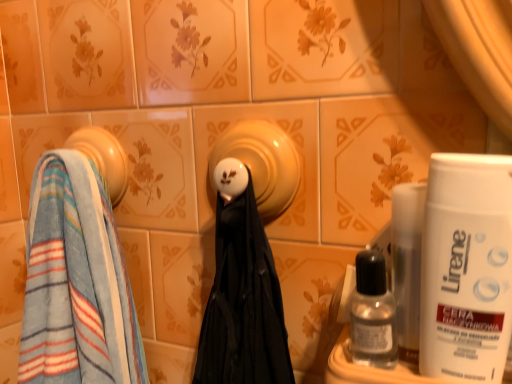
Question: Is transparent plastic bottle at lower right positioned behind blue striped towel at left, positioned as the 1th towel in top-to-bottom order?

Choices:
 (A) no
 (B) yes

Answer: (A)

Question: Is transparent plastic bottle at lower right facing towards blue striped towel at left, positioned as the second towel in bottom-to-top order?

Choices:
 (A) no
 (B) yes

Answer: (A)

Question: From the image's perspective, does transparent plastic bottle at lower right appear higher than blue striped towel at left, positioned as the 1th towel in top-to-bottom order?

Choices:
 (A) no
 (B) yes

Answer: (A)

Question: Can you confirm if transparent plastic bottle at lower right is wider than blue striped towel at left, positioned as the 1th towel in top-to-bottom order?

Choices:
 (A) no
 (B) yes

Answer: (B)

Question: From a real-world perspective, is transparent plastic bottle at lower right on top of blue striped towel at left, positioned as the second towel in bottom-to-top order?

Choices:
 (A) no
 (B) yes

Answer: (A)

Question: Is point (455, 246) positioned closer to the camera than point (391, 301)?

Choices:
 (A) farther
 (B) closer

Answer: (B)

Question: Considering the positions of white matte shaving cream at right and transparent plastic bottle at lower right in the image, is white matte shaving cream at right bigger or smaller than transparent plastic bottle at lower right?

Choices:
 (A) small
 (B) big

Answer: (B)

Question: From the image's perspective, is white matte shaving cream at right above or below transparent plastic bottle at lower right?

Choices:
 (A) below
 (B) above

Answer: (B)

Question: In terms of height, does white matte shaving cream at right look taller or shorter compared to transparent plastic bottle at lower right?

Choices:
 (A) short
 (B) tall

Answer: (B)

Question: In terms of width, does matte yellow ceramic at center look wider or thinner when compared to blue striped towel at left, positioned as the 1th towel in top-to-bottom order?

Choices:
 (A) wide
 (B) thin

Answer: (A)

Question: From their relative heights in the image, would you say matte yellow ceramic at center is taller or shorter than blue striped towel at left, positioned as the second towel in bottom-to-top order?

Choices:
 (A) short
 (B) tall

Answer: (B)

Question: Is matte yellow ceramic at center inside or outside of blue striped towel at left, positioned as the second towel in bottom-to-top order?

Choices:
 (A) outside
 (B) inside

Answer: (A)

Question: From a real-world perspective, is matte yellow ceramic at center positioned above or below blue striped towel at left, positioned as the 1th towel in top-to-bottom order?

Choices:
 (A) below
 (B) above

Answer: (A)

Question: Is matte yellow ceramic at center spatially inside white matte shaving cream at right, or outside of it?

Choices:
 (A) outside
 (B) inside

Answer: (A)

Question: Is matte yellow ceramic at center in front of or behind white matte shaving cream at right in the image?

Choices:
 (A) behind
 (B) front

Answer: (A)